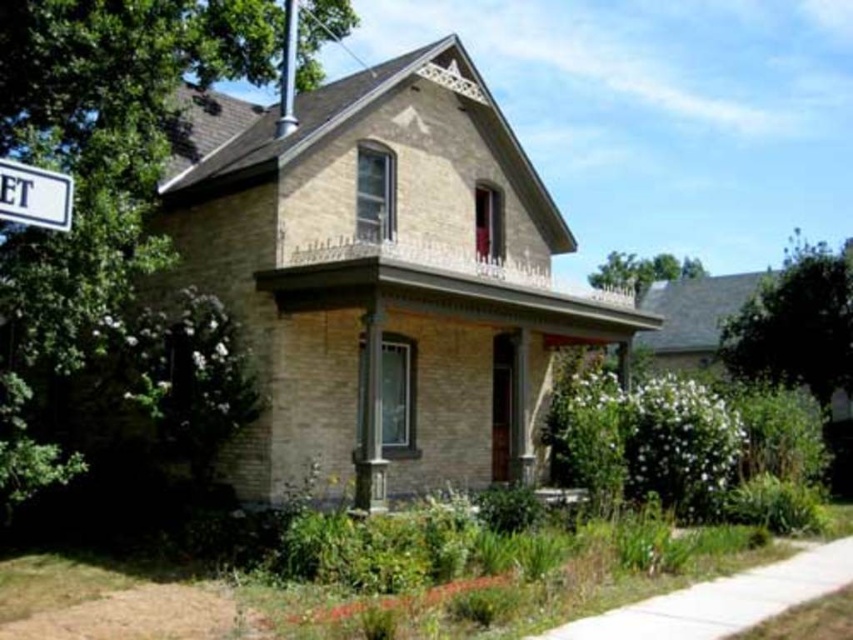
Question: Is white plastic street sign at upper left wider than silver metallic pole at upper center?

Choices:
 (A) no
 (B) yes

Answer: (A)

Question: Where is white plastic street sign at upper left located in relation to silver metallic pole at upper center in the image?

Choices:
 (A) below
 (B) above

Answer: (A)

Question: Which of the following is the closest to the observer?

Choices:
 (A) silver metallic pole at upper center
 (B) white plastic street sign at upper left

Answer: (B)

Question: Does white plastic street sign at upper left appear on the left side of silver metallic pole at upper center?

Choices:
 (A) yes
 (B) no

Answer: (A)